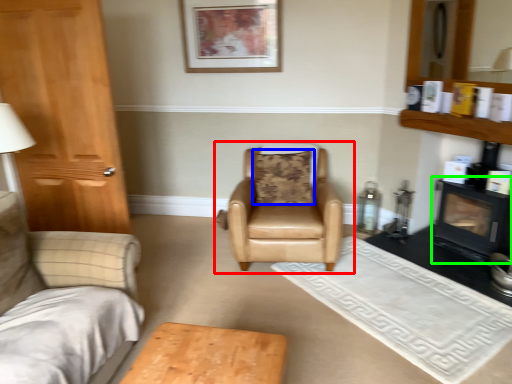
Question: Considering the real-world distances, which object is farthest from chair (highlighted by a red box)? pillow (highlighted by a blue box) or fireplace (highlighted by a green box)?

Choices:
 (A) pillow
 (B) fireplace

Answer: (B)